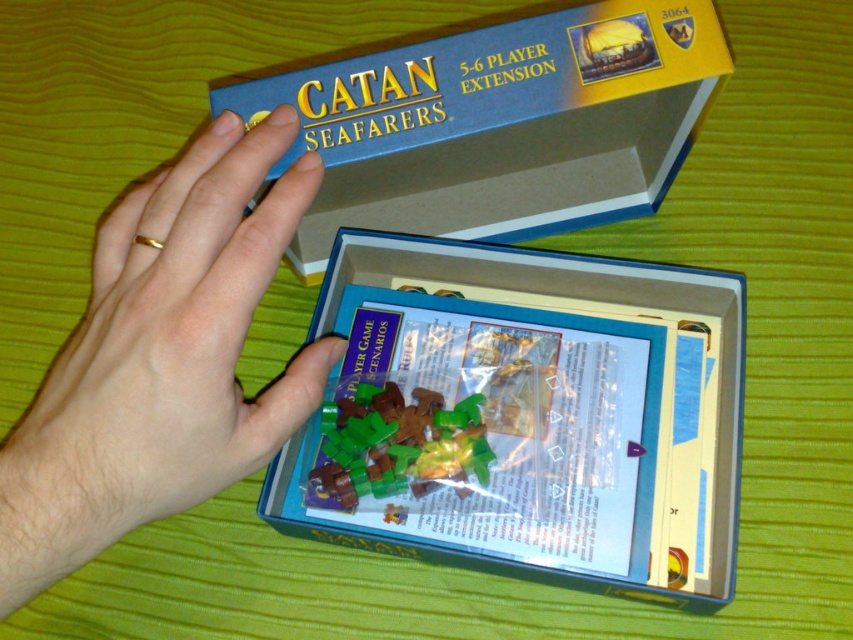
I want to click on blue cardboard box at upper center, so click(498, 124).

Does point (524, 141) come behind point (219, 449)?

Yes.

Between point (397, 192) and point (0, 484), which one is positioned behind?

Positioned behind is point (397, 192).

The height and width of the screenshot is (640, 853). I want to click on blue cardboard box at upper center, so click(x=498, y=124).

Does gold metallic ring at upper left have a greater height compared to green plastic pieces at center?

Correct, gold metallic ring at upper left is much taller as green plastic pieces at center.

Who is shorter, gold metallic ring at upper left or green plastic pieces at center?

Standing shorter between the two is green plastic pieces at center.

Who is more distant from viewer, (177, 330) or (341, 499)?

The point (341, 499) is more distant.

You are a GUI agent. You are given a task and a screenshot of the screen. Output one action in this format:
    pyautogui.click(x=<x>, y=<y>)
    Task: Click on the gold metallic ring at upper left
    This screenshot has width=853, height=640.
    Given the screenshot: What is the action you would take?
    pyautogui.click(x=167, y=349)

Does translucent plastic bag at center appear on the left side of blue cardboard box at upper center?

Incorrect, translucent plastic bag at center is not on the left side of blue cardboard box at upper center.

Can you confirm if translucent plastic bag at center is bigger than blue cardboard box at upper center?

Yes.

I want to click on translucent plastic bag at center, so click(531, 416).